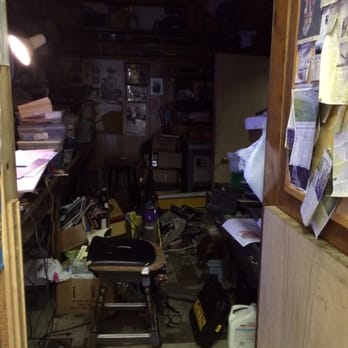
Locate an element on the screen. light is located at coordinates (8, 49).